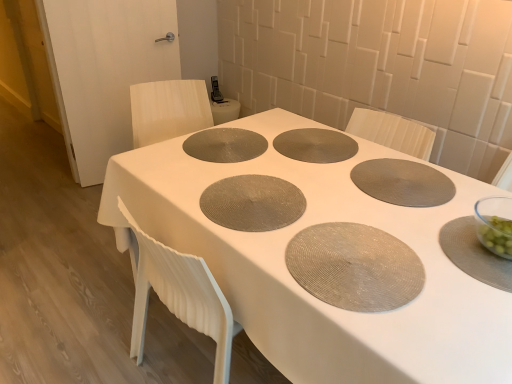
In order to click on vacant space in between matte gray placemat at center, acting as the first pizza pan starting from the left, and matte gray placemat at center, placed as the 2th oval when sorted from back to front in this screenshot , I will do `click(294, 226)`.